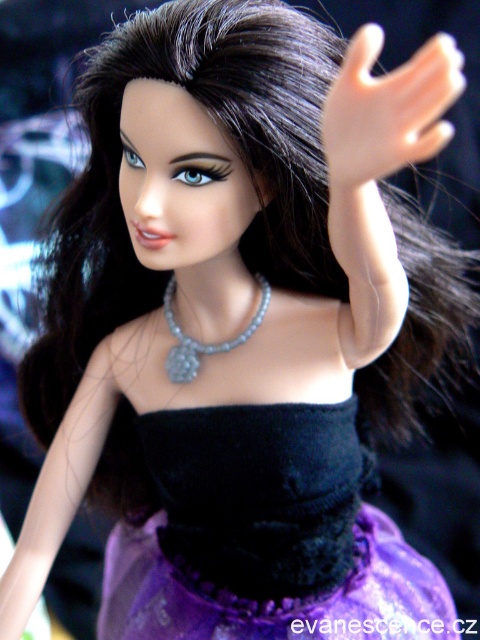
You are holding a measuring tape and want to measure the distance from your eyes to the point marked at coordinates point (398, 125) on the doll. According to the image, what is this distance?

The distance from the camera to point (398, 125) is 19.60 inches.